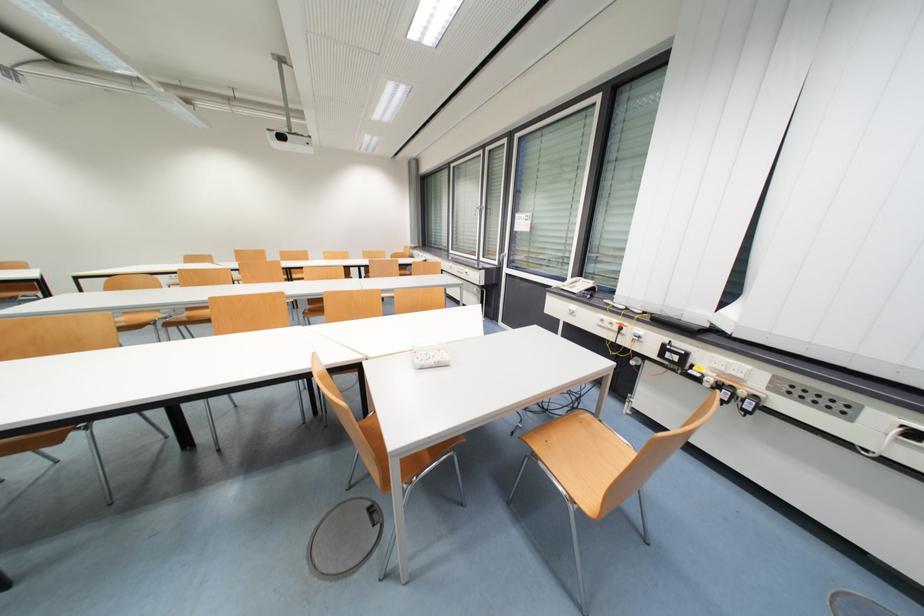
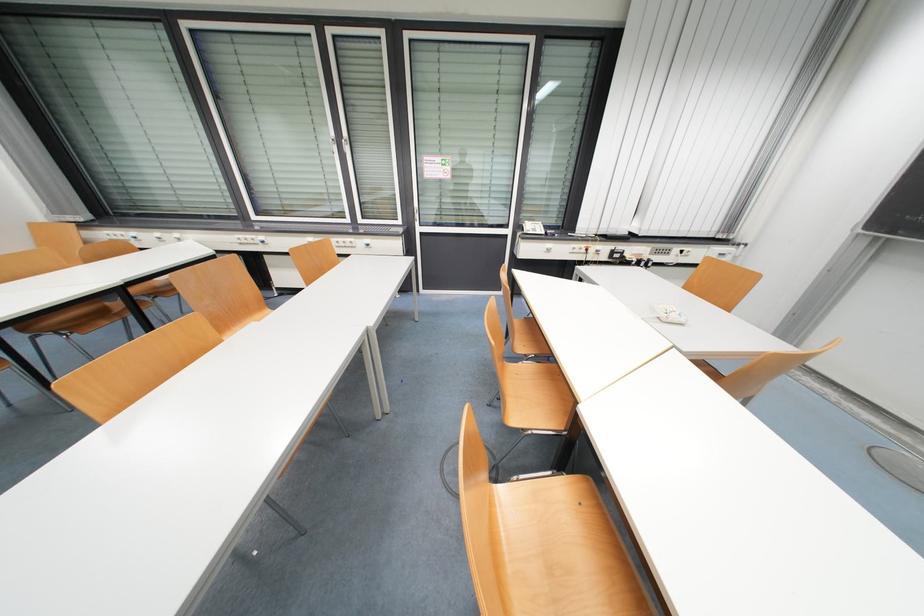
Find the pixel in the second image that matches (622,323) in the first image.

(589, 246)